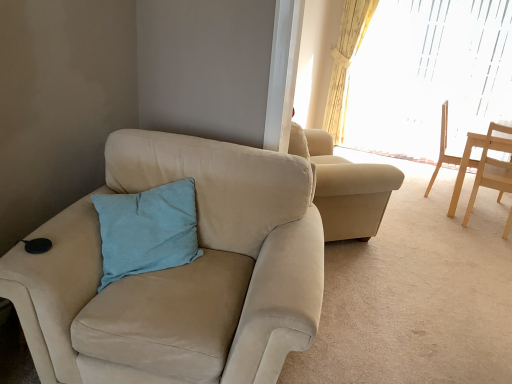
Question: Could light blue fabric pillow at center be considered to be inside suede beige chair at left, the third chair in the right-to-left sequence?

Choices:
 (A) no
 (B) yes

Answer: (B)

Question: Is suede beige chair at left, acting as the third chair starting from the back, smaller than light blue fabric pillow at center?

Choices:
 (A) yes
 (B) no

Answer: (B)

Question: From a real-world perspective, is suede beige chair at left, acting as the third chair starting from the back, located beneath light blue fabric pillow at center?

Choices:
 (A) no
 (B) yes

Answer: (B)

Question: Is suede beige chair at left, acting as the 1th chair starting from the front, aimed at light blue fabric pillow at center?

Choices:
 (A) no
 (B) yes

Answer: (B)

Question: Is the depth of suede beige chair at left, acting as the 1th chair starting from the front, less than that of light blue fabric pillow at center?

Choices:
 (A) yes
 (B) no

Answer: (A)

Question: Relative to light wood chair at right, which appears as the 1th chair when viewed from the right, is light blue fabric pillow at center in front or behind?

Choices:
 (A) front
 (B) behind

Answer: (A)

Question: Is light blue fabric pillow at center taller or shorter than light wood chair at right, which is counted as the 3th chair, starting from the left?

Choices:
 (A) short
 (B) tall

Answer: (A)

Question: In terms of width, does light blue fabric pillow at center look wider or thinner when compared to light wood chair at right, which is the second chair from back to front?

Choices:
 (A) thin
 (B) wide

Answer: (A)

Question: Considering the positions of light blue fabric pillow at center and light wood chair at right, which is counted as the 3th chair, starting from the left, in the image, is light blue fabric pillow at center bigger or smaller than light wood chair at right, which is counted as the 3th chair, starting from the left,?

Choices:
 (A) small
 (B) big

Answer: (A)

Question: Does point (510, 220) appear closer or farther from the camera than point (173, 337)?

Choices:
 (A) closer
 (B) farther

Answer: (B)

Question: Considering the positions of light wood chair at right, which is the second chair from back to front, and suede beige chair at left, acting as the third chair starting from the back, in the image, is light wood chair at right, which is the second chair from back to front, bigger or smaller than suede beige chair at left, acting as the third chair starting from the back,?

Choices:
 (A) small
 (B) big

Answer: (A)

Question: Is light wood chair at right, which appears as the 1th chair when viewed from the right, situated inside suede beige chair at left, arranged as the 1th chair when viewed from the left, or outside?

Choices:
 (A) outside
 (B) inside

Answer: (A)

Question: Is light wood chair at right, which is counted as the 3th chair, starting from the left, taller or shorter than suede beige chair at left, acting as the third chair starting from the back?

Choices:
 (A) short
 (B) tall

Answer: (B)

Question: Looking at the image, does light brown wooden chair at right, which is the second chair from right to left, seem bigger or smaller compared to suede beige chair at left, the third chair in the right-to-left sequence?

Choices:
 (A) big
 (B) small

Answer: (B)

Question: Considering the positions of light brown wooden chair at right, which is the second chair from right to left, and suede beige chair at left, acting as the third chair starting from the back, in the image, is light brown wooden chair at right, which is the second chair from right to left, taller or shorter than suede beige chair at left, acting as the third chair starting from the back,?

Choices:
 (A) tall
 (B) short

Answer: (A)